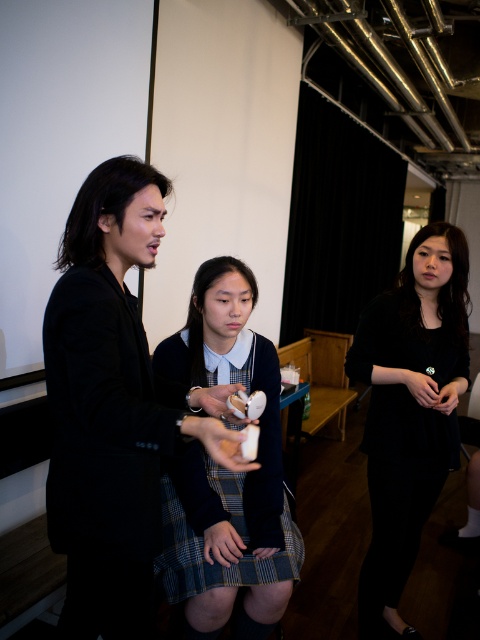
Question: Is matte white controller at center further to the viewer compared to black matte dress at right?

Choices:
 (A) yes
 (B) no

Answer: (B)

Question: Can you confirm if matte white controller at center is positioned to the right of black matte dress at right?

Choices:
 (A) no
 (B) yes

Answer: (A)

Question: Can you confirm if plaid skirt at center is positioned below matte white controller at center?

Choices:
 (A) no
 (B) yes

Answer: (A)

Question: Which point is closer to the camera?

Choices:
 (A) plaid skirt at center
 (B) matte white controller at center

Answer: (A)

Question: Which object is positioned farthest from the plaid skirt at center?

Choices:
 (A) matte white controller at center
 (B) black matte dress at right

Answer: (B)

Question: Which of the following is the farthest from the observer?

Choices:
 (A) black matte dress at right
 (B) plaid skirt at center

Answer: (A)